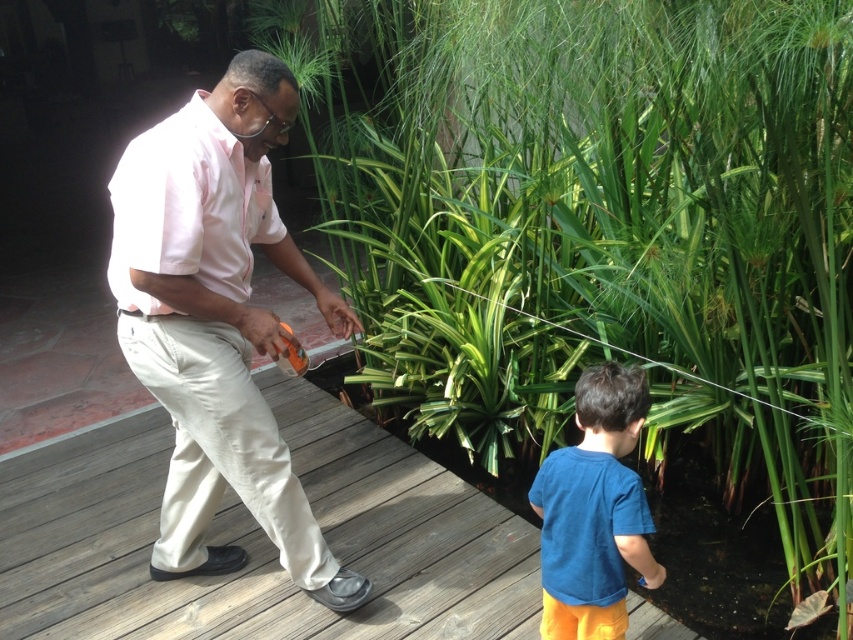
You are a gardener standing on the wooden deck. You need to place a new potted plant that is 3 feet wide between the green leafy plant at center and the blue cotton shirt at lower right. Can you fit it there?

The green leafy plant at center might be wider than blue cotton shirt at lower right, so the space between them may not be wide enough to fit a 3 feet wide potted plant. Check the actual width before placing it.

You are standing on the wooden deck at center and want to reach the blue cotton shirt at lower right. Which direction should you move to get closer to it?

The wooden deck at center is positioned under the blue cotton shirt at lower right, so you should move upward to reach it.